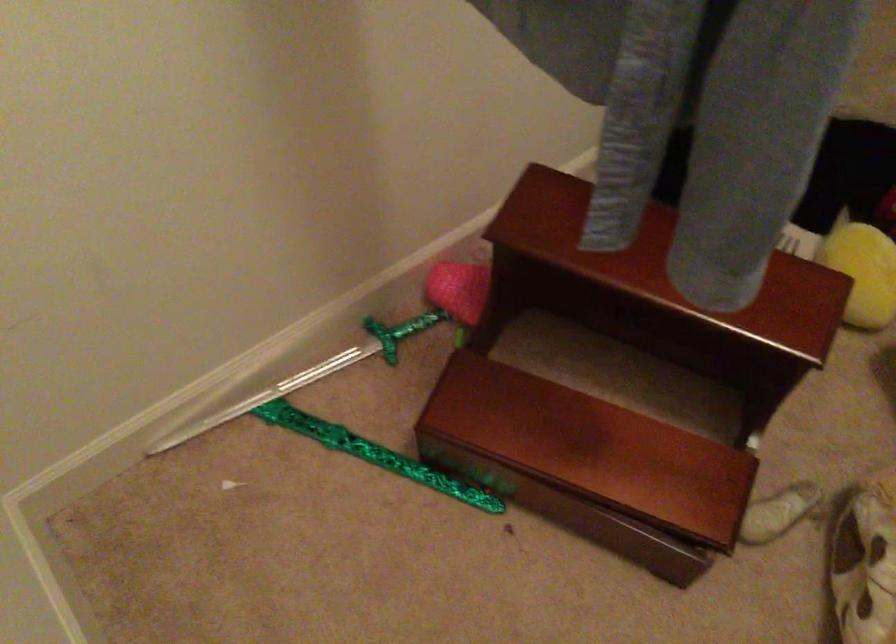
In order to click on sword handle in this screenshot , I will do click(418, 323).